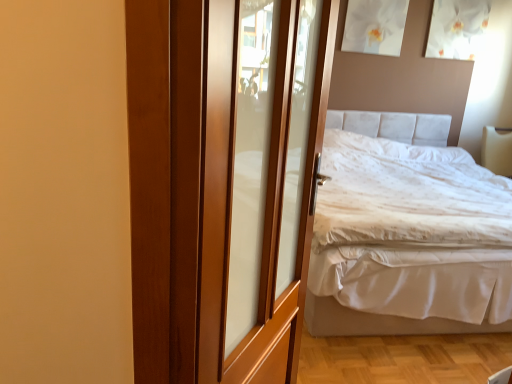
Find the location of `wooden door at center`. wooden door at center is located at coordinates (224, 182).

The height and width of the screenshot is (384, 512). Describe the element at coordinates (224, 182) in the screenshot. I see `wooden door at center` at that location.

The height and width of the screenshot is (384, 512). What do you see at coordinates (407, 233) in the screenshot?
I see `white fabric bed at right` at bounding box center [407, 233].

In order to face white fabric bed at right, should I rotate leftwards or rightwards?

You should look right and rotate roughly 19.278 degrees.

This screenshot has height=384, width=512. Identify the location of white fabric bed at right. point(407,233).

I want to click on wooden door at center, so click(x=224, y=182).

Can you confirm if wooden door at center is positioned to the left of white fabric bed at right?

Yes, wooden door at center is to the left of white fabric bed at right.

In the image, is wooden door at center positioned in front of or behind white fabric bed at right?

wooden door at center is in front of white fabric bed at right.

Is point (301, 252) closer to camera compared to point (408, 229)?

Yes, it is.

From the image's perspective, is wooden door at center below white fabric bed at right?

Correct, wooden door at center appears lower than white fabric bed at right in the image.

Looking at this image, from a real-world perspective, relative to white fabric bed at right, is wooden door at center vertically above or below?

Clearly, from a real-world perspective, wooden door at center is above white fabric bed at right.

Is wooden door at center wider than white fabric bed at right?

No.

From their relative heights in the image, would you say wooden door at center is taller or shorter than white fabric bed at right?

Considering their sizes, wooden door at center has more height than white fabric bed at right.

Does wooden door at center have a smaller size compared to white fabric bed at right?

Yes.

Is white fabric bed at right located within wooden door at center?

No, white fabric bed at right is not surrounded by wooden door at center.

Is wooden door at center next to white fabric bed at right and touching it?

No, wooden door at center is not touching white fabric bed at right.

From the picture: Could you tell me if wooden door at center is turned towards white fabric bed at right?

No, wooden door at center does not turn towards white fabric bed at right.

This screenshot has height=384, width=512. Identify the location of door on the left of white fabric bed at right. (224, 182).

Considering the positions of objects white fabric bed at right and wooden door at center in the image provided, who is more to the right, white fabric bed at right or wooden door at center?

white fabric bed at right is more to the right.

Looking at this image, relative to wooden door at center, is white fabric bed at right in front or behind?

white fabric bed at right is positioned farther from the viewer than wooden door at center.

Which is in front, point (324, 215) or point (160, 187)?

Point (160, 187)

From the image's perspective, between white fabric bed at right and wooden door at center, which one is located above?

white fabric bed at right is shown above in the image.

From a real-world perspective, is white fabric bed at right physically located above or below wooden door at center?

Clearly, from a real-world perspective, white fabric bed at right is below wooden door at center.

Which object is wider, white fabric bed at right or wooden door at center?

Wider between the two is white fabric bed at right.

Is white fabric bed at right shorter than wooden door at center?

Correct, white fabric bed at right is not as tall as wooden door at center.

Between white fabric bed at right and wooden door at center, which one has smaller size?

Smaller between the two is wooden door at center.

Which is correct: white fabric bed at right is inside wooden door at center, or outside of it?

white fabric bed at right lies outside wooden door at center.

Would you say white fabric bed at right is a long distance from wooden door at center?

Yes, white fabric bed at right and wooden door at center are quite far apart.

Is white fabric bed at right oriented away from wooden door at center?

No.

How many degrees apart are the facing directions of white fabric bed at right and wooden door at center?

57.1 degrees separate the facing orientations of white fabric bed at right and wooden door at center.

The image size is (512, 384). What are the coordinates of `door located below the white fabric bed at right (from the image's perspective)` in the screenshot? It's located at (224, 182).

What are the coordinates of `door on the left of white fabric bed at right` in the screenshot? It's located at (224, 182).

Where is `door that appears in front of the white fabric bed at right`? The image size is (512, 384). door that appears in front of the white fabric bed at right is located at coordinates (224, 182).